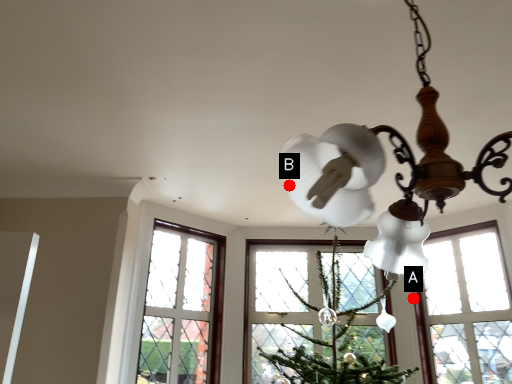
Question: Two points are circled on the image, labeled by A and B beside each circle. Which point is closer to the camera taking this photo?

Choices:
 (A) A is closer
 (B) B is closer

Answer: (B)